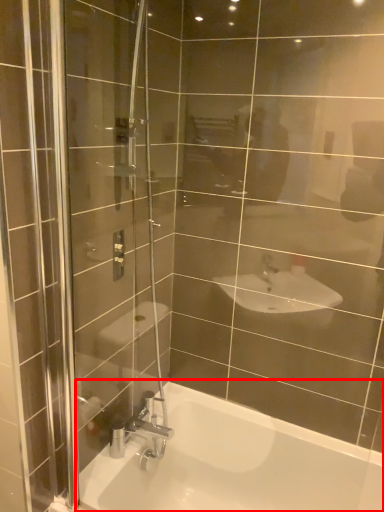
Question: From the image's perspective, what is the correct spatial relationship of bathtub (annotated by the red box) in relation to shower?

Choices:
 (A) below
 (B) above

Answer: (A)